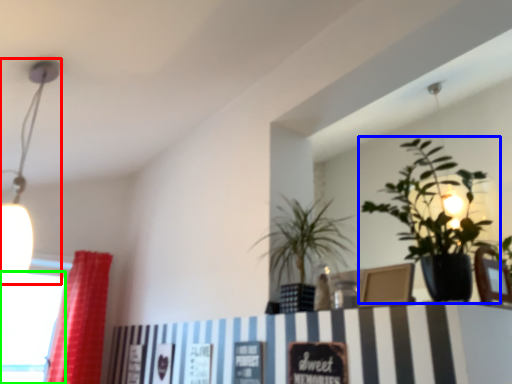
Question: Which object is the closest to the lamp (highlighted by a red box)? Choose among these: houseplant (highlighted by a blue box) or window (highlighted by a green box).

Choices:
 (A) houseplant
 (B) window

Answer: (B)